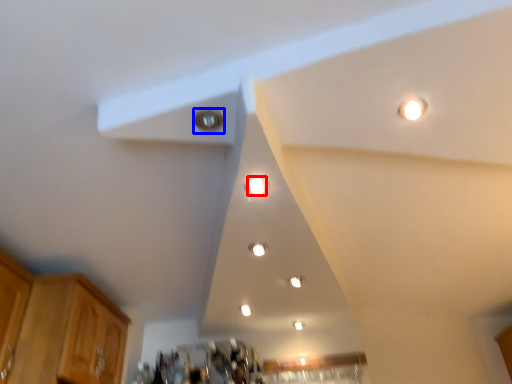
Question: Which of the following is the farthest to the observer, dot (highlighted by a red box) or light (highlighted by a blue box)?

Choices:
 (A) dot
 (B) light

Answer: (A)